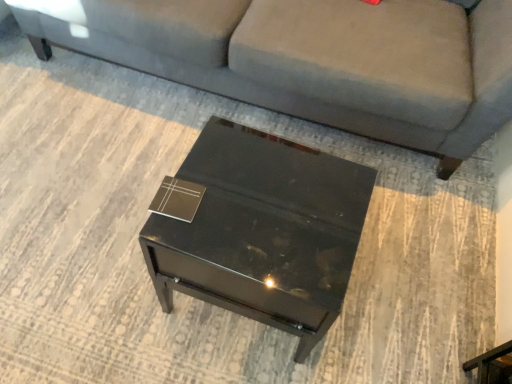
Question: Is matte black book at center turned away from glossy black side table at center?

Choices:
 (A) yes
 (B) no

Answer: (B)

Question: From a real-world perspective, is matte black book at center positioned over glossy black side table at center based on gravity?

Choices:
 (A) no
 (B) yes

Answer: (B)

Question: Does matte black book at center appear on the right side of glossy black side table at center?

Choices:
 (A) yes
 (B) no

Answer: (B)

Question: From the image's perspective, is matte black book at center under glossy black side table at center?

Choices:
 (A) no
 (B) yes

Answer: (A)

Question: Considering the relative sizes of matte black book at center and glossy black side table at center in the image provided, is matte black book at center taller than glossy black side table at center?

Choices:
 (A) yes
 (B) no

Answer: (B)

Question: Considering the positions of glossy black side table at center and matte black book at center in the image, is glossy black side table at center bigger or smaller than matte black book at center?

Choices:
 (A) big
 (B) small

Answer: (A)

Question: Is point (298, 284) closer or farther from the camera than point (185, 211)?

Choices:
 (A) closer
 (B) farther

Answer: (A)

Question: In terms of width, does glossy black side table at center look wider or thinner when compared to matte black book at center?

Choices:
 (A) thin
 (B) wide

Answer: (B)

Question: Do you think glossy black side table at center is within matte black book at center, or outside of it?

Choices:
 (A) outside
 (B) inside

Answer: (A)

Question: In the image, is gray fabric couch at center positioned in front of or behind matte black book at center?

Choices:
 (A) front
 (B) behind

Answer: (B)

Question: From a real-world perspective, relative to matte black book at center, is gray fabric couch at center vertically above or below?

Choices:
 (A) above
 (B) below

Answer: (B)

Question: From the image's perspective, is gray fabric couch at center positioned above or below matte black book at center?

Choices:
 (A) above
 (B) below

Answer: (A)

Question: Considering the positions of gray fabric couch at center and matte black book at center in the image, is gray fabric couch at center wider or thinner than matte black book at center?

Choices:
 (A) thin
 (B) wide

Answer: (B)

Question: Considering the relative positions of matte black book at center and glossy black side table at center in the image provided, is matte black book at center to the left or to the right of glossy black side table at center?

Choices:
 (A) right
 (B) left

Answer: (B)

Question: Is matte black book at center spatially inside glossy black side table at center, or outside of it?

Choices:
 (A) outside
 (B) inside

Answer: (A)